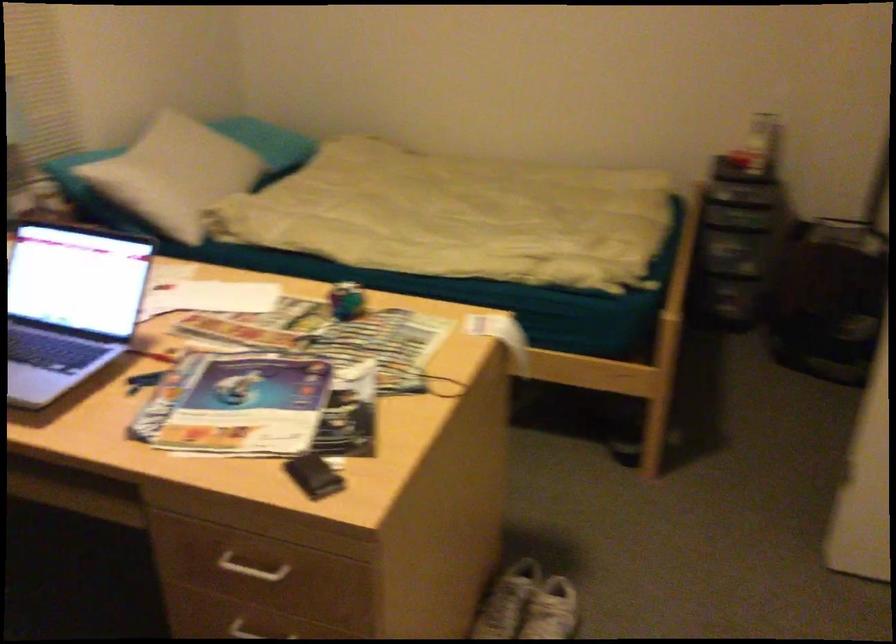
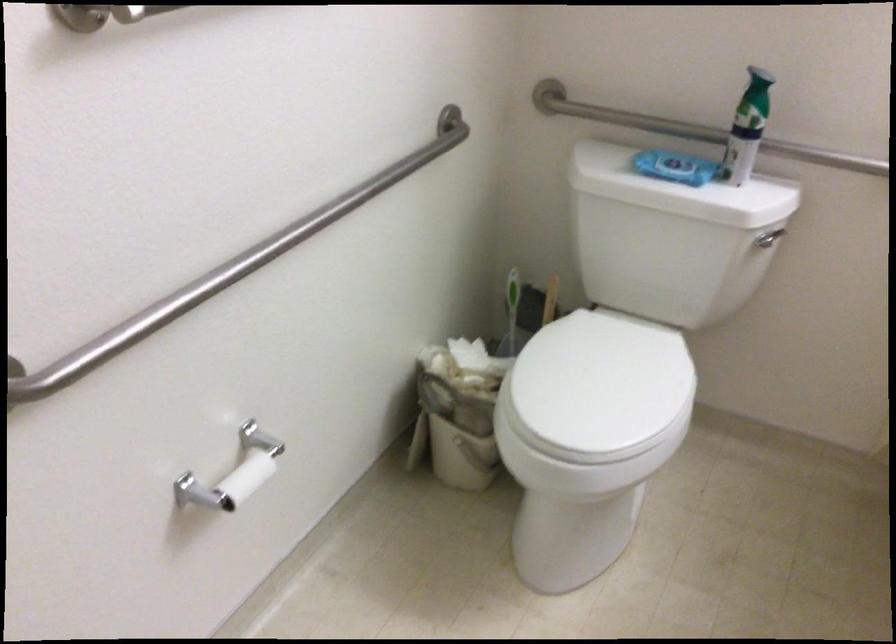
Question: In a continuous first-person perspective shot, in which direction is the camera moving?

Choices:
 (A) Left
 (B) Right
 (C) Forward
 (D) Backward

Answer: (B)